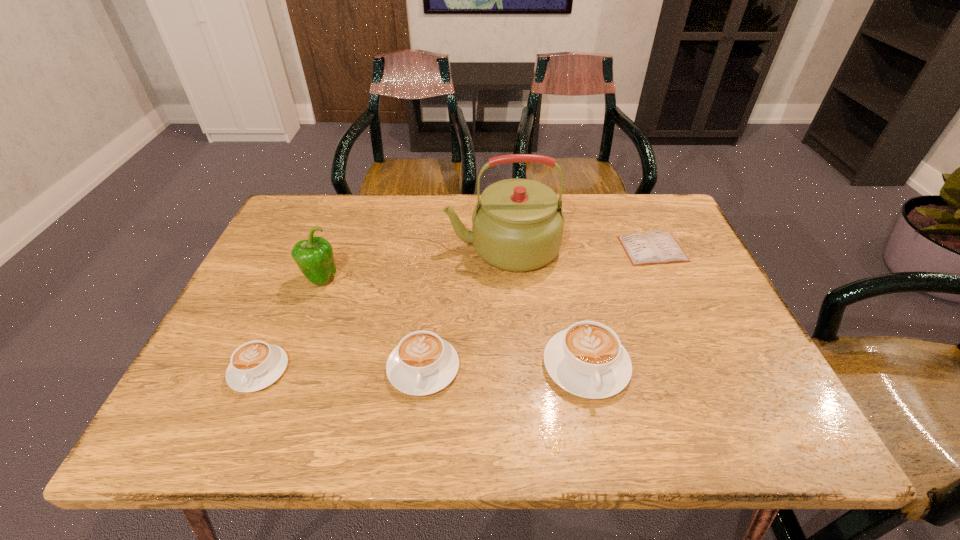
I want to click on vacant space in between the shortest cappuccino and the kettle, so click(x=381, y=309).

I want to click on free space between the kettle and the leftmost cappuccino, so click(381, 309).

This screenshot has width=960, height=540. Identify the location of vacant point located between the shortest object and the kettle. (578, 248).

Where is `free space between the leftmost cappuccino and the diary`? free space between the leftmost cappuccino and the diary is located at coordinates (456, 309).

You are a GUI agent. You are given a task and a screenshot of the screen. Output one action in this format:
    pyautogui.click(x=<x>, y=<y>)
    Task: Click on the blank region between the tallest cappuccino and the bell pepper
    
    Given the screenshot: What is the action you would take?
    pyautogui.click(x=453, y=322)

At what (x,y) coordinates should I click in order to perform the action: click on empty space that is in between the rightmost cappuccino and the fourth tallest object. Please return your answer as a coordinate pair (x, y). This screenshot has width=960, height=540. Looking at the image, I should click on coord(505,367).

At what (x,y) coordinates should I click in order to perform the action: click on free space between the second cappuccino from left to right and the shortest object. Please return your answer as a coordinate pair (x, y). The image size is (960, 540). Looking at the image, I should click on click(x=538, y=308).

The width and height of the screenshot is (960, 540). I want to click on vacant space that is in between the second tallest object and the shortest object, so click(487, 264).

The width and height of the screenshot is (960, 540). I want to click on object that ranks as the fourth closest to the bell pepper, so pyautogui.click(x=587, y=359).

Locate an element on the screen. This screenshot has height=540, width=960. object that stands as the fifth closest to the rightmost cappuccino is located at coordinates (255, 365).